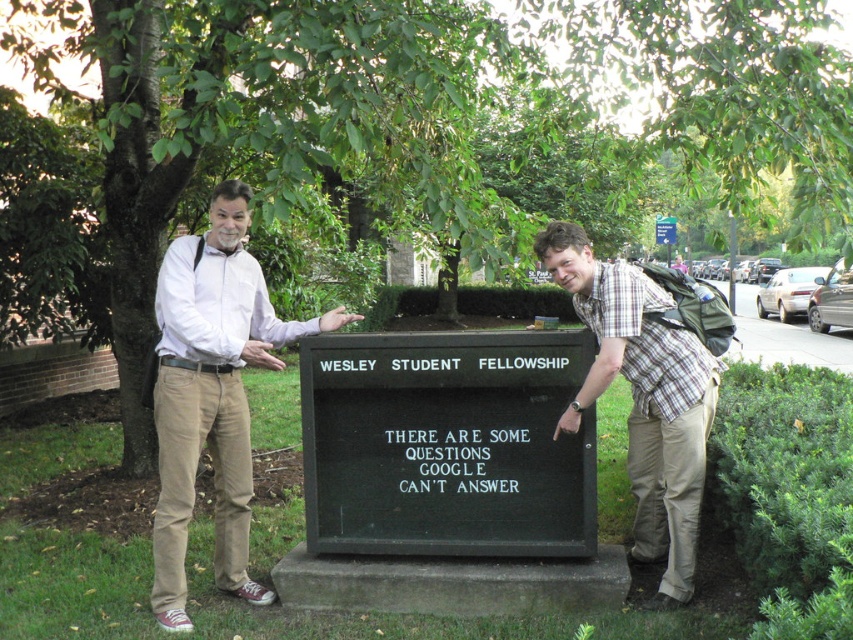
Consider the image. You are a photographer trying to capture a clear shot of both the black matte sign at center and the plaid shirt at right. Since you want both subjects to be in focus, which one should you focus on first to ensure depth of field?

You should focus on the black matte sign at center first because it is closer to you than the plaid shirt at right. By focusing on the closer object, the depth of field will extend backward, potentially keeping both in focus.

You are a photographer trying to capture a photo where the light brown pants at left are positioned to the left of the black matte sign at center. Based on the current arrangement, is this already the case?

Yes, the black matte sign at center is to the right of light brown pants at left, so the light brown pants at left are already positioned to the left of the black matte sign at center.

Based on the scene description, where exactly is the light brown pants at left located?

The light brown pants at left is located at point (212, 394).